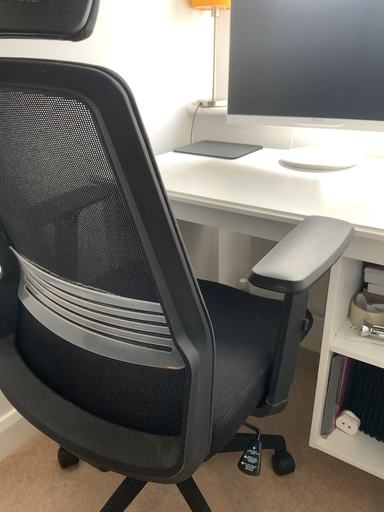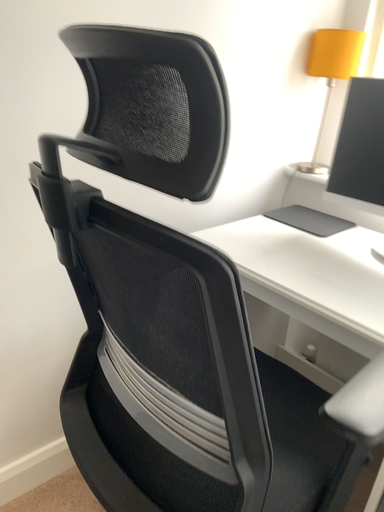
Question: Which way did the camera rotate in the video?

Choices:
 (A) rotated right
 (B) rotated left

Answer: (B)